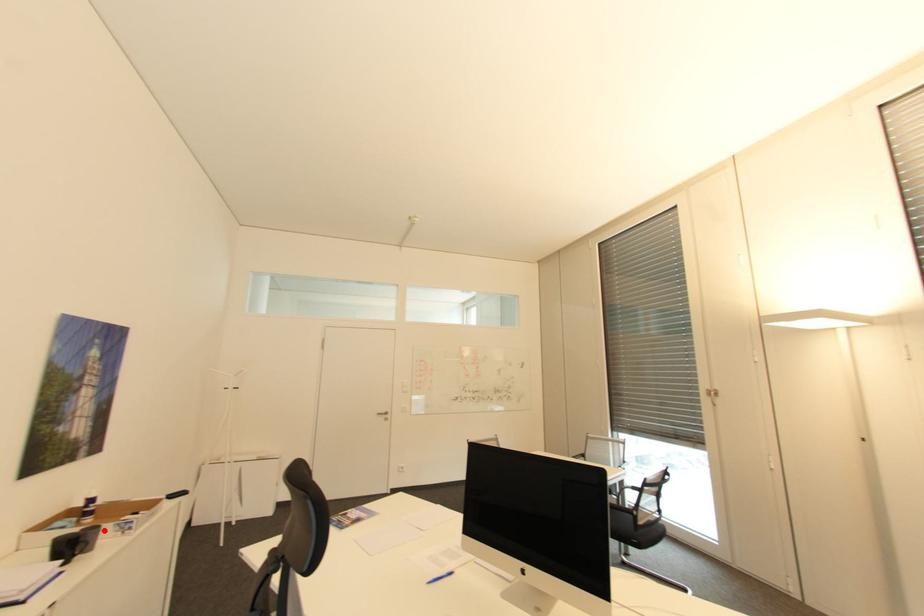
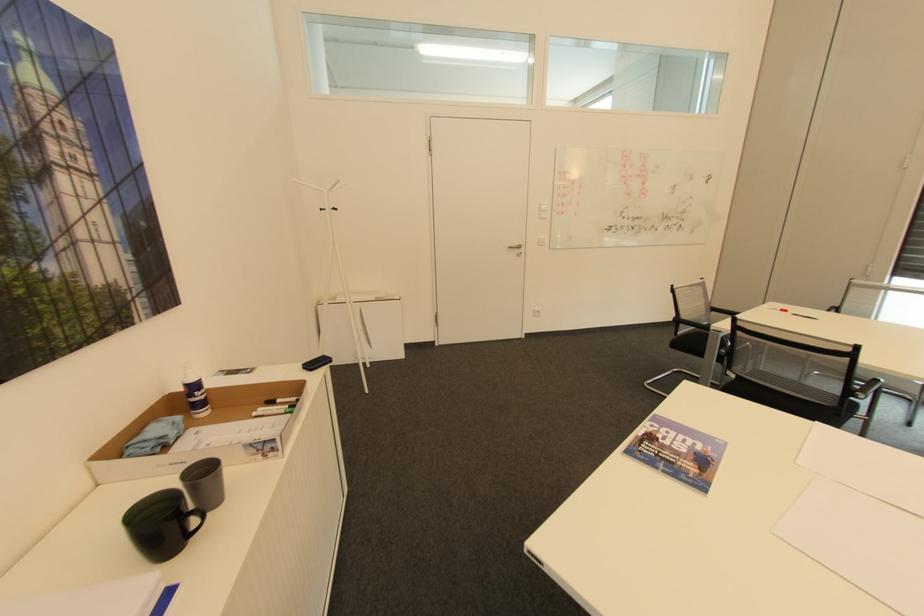
In the second image, find the point that corresponds to the highlighted location in the first image.

(222, 477)